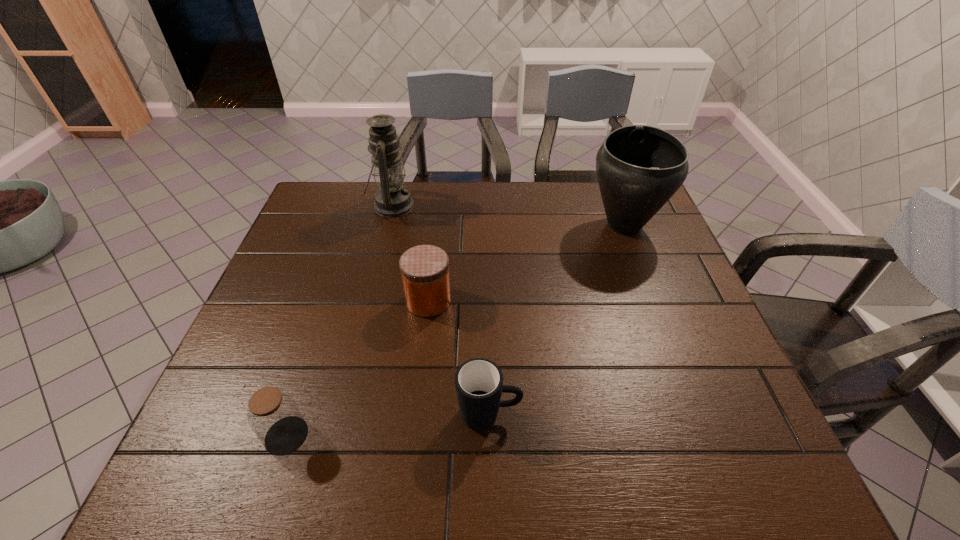
The height and width of the screenshot is (540, 960). What are the coordinates of `oil lamp` in the screenshot? It's located at (392, 199).

This screenshot has height=540, width=960. I want to click on urn, so click(639, 168).

At what (x,y) coordinates should I click in order to perform the action: click on the third farthest object. Please return your answer as a coordinate pair (x, y). The width and height of the screenshot is (960, 540). Looking at the image, I should click on (424, 269).

Find the location of `the right jar`. the right jar is located at coordinates (424, 269).

Where is `mug`? mug is located at coordinates (479, 385).

Locate an element on the screen. the nearer jar is located at coordinates (273, 415).

In order to click on vacant space located 0.070m on the front of the oil lamp in this screenshot , I will do `click(384, 238)`.

Where is `free space located 0.290m on the left of the rightmost object`? Image resolution: width=960 pixels, height=540 pixels. free space located 0.290m on the left of the rightmost object is located at coordinates (492, 226).

The width and height of the screenshot is (960, 540). In order to click on vacant area situated 0.280m on the right of the right jar in this screenshot , I will do `click(560, 301)`.

Identify the location of free region located 0.130m on the side of the fourth object from left to right with the handle. Image resolution: width=960 pixels, height=540 pixels. (584, 414).